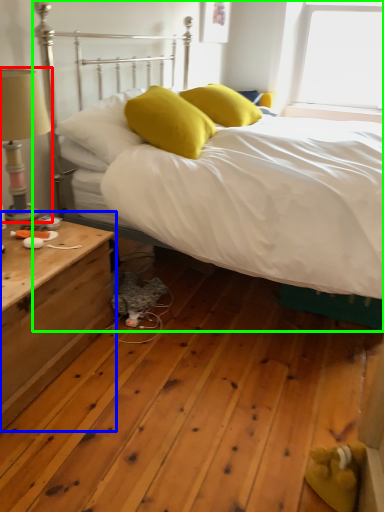
Question: Which is farther away from table lamp (highlighted by a red box)? nightstand (highlighted by a blue box) or bed (highlighted by a green box)?

Choices:
 (A) nightstand
 (B) bed

Answer: (A)